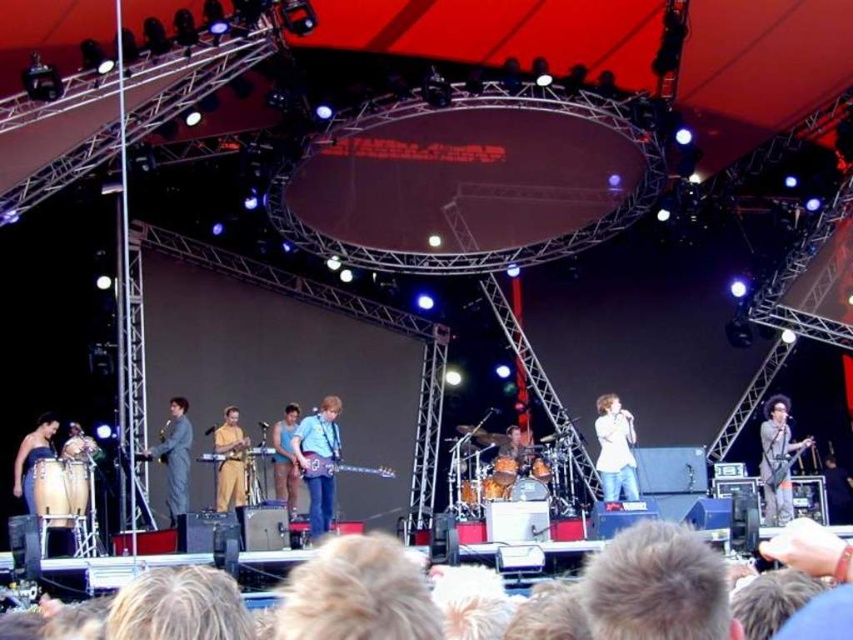
Question: Does white cotton shirt at center appear over light brown leather guitar at center?

Choices:
 (A) no
 (B) yes

Answer: (B)

Question: Which of the following is the farthest from the observer?

Choices:
 (A) (778, 422)
 (B) (28, 483)
 (C) (173, 428)
 (D) (235, 506)

Answer: (A)

Question: Which point appears closest to the camera in this image?

Choices:
 (A) (317, 460)
 (B) (607, 499)
 (C) (279, 461)

Answer: (A)

Question: Does gray fabric suit at center appear over golden fabric dress at center?

Choices:
 (A) no
 (B) yes

Answer: (B)

Question: Which point is farther to the camera?

Choices:
 (A) metallic electric guitar at center
 (B) gray fabric suit at center

Answer: (B)

Question: Does blue fabric shirt at center appear under metallic electric guitar at center?

Choices:
 (A) no
 (B) yes

Answer: (A)